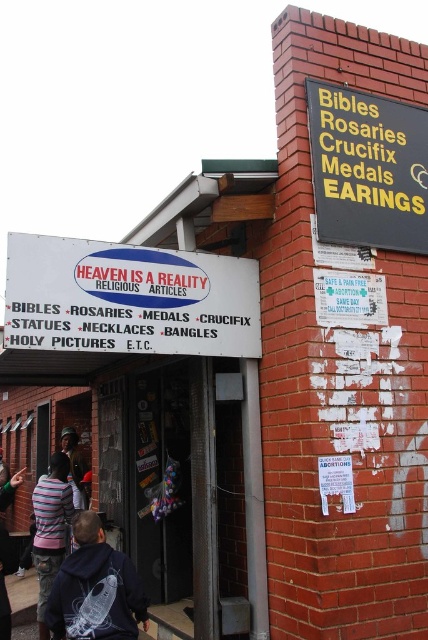
You are standing in front of the building and want to read the text on the yellow plastic sign at upper right. Can you read it clearly without moving closer?

The yellow plastic sign at upper right is 3.53 meters from the camera, so you can read it clearly without moving closer.

You are standing in front of the brick building and want to locate the white plastic signboard at center. What are the coordinates where you should look?

The white plastic signboard at center is located at coordinates point [128,298].

You are a customer entering the store and notice the yellow plastic sign at upper right and the striped sweater at lower left. Which object is larger in size?

The yellow plastic sign at upper right is bigger than the striped sweater at lower left.